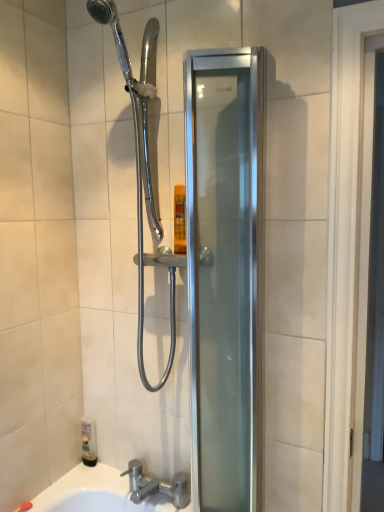
Question: Is translucent plastic bottle at lower left smaller than satin silver glass shower door at center?

Choices:
 (A) yes
 (B) no

Answer: (A)

Question: Is translucent plastic bottle at lower left bigger than satin silver glass shower door at center?

Choices:
 (A) yes
 (B) no

Answer: (B)

Question: Would you say translucent plastic bottle at lower left is outside satin silver glass shower door at center?

Choices:
 (A) no
 (B) yes

Answer: (B)

Question: Does translucent plastic bottle at lower left appear on the right side of satin silver glass shower door at center?

Choices:
 (A) yes
 (B) no

Answer: (B)

Question: From the image's perspective, is translucent plastic bottle at lower left under satin silver glass shower door at center?

Choices:
 (A) yes
 (B) no

Answer: (A)

Question: Is satin silver glass shower door at center situated inside silver metallic faucet at lower center or outside?

Choices:
 (A) inside
 (B) outside

Answer: (B)

Question: In terms of height, does satin silver glass shower door at center look taller or shorter compared to silver metallic faucet at lower center?

Choices:
 (A) short
 (B) tall

Answer: (B)

Question: Visually, is satin silver glass shower door at center positioned to the left or to the right of silver metallic faucet at lower center?

Choices:
 (A) right
 (B) left

Answer: (A)

Question: Based on their sizes in the image, would you say satin silver glass shower door at center is bigger or smaller than silver metallic faucet at lower center?

Choices:
 (A) big
 (B) small

Answer: (A)

Question: Looking at their shapes, would you say silver metallic faucet at lower center is wider or thinner than translucent plastic bottle at lower left?

Choices:
 (A) wide
 (B) thin

Answer: (A)

Question: Is silver metallic faucet at lower center situated inside translucent plastic bottle at lower left or outside?

Choices:
 (A) inside
 (B) outside

Answer: (B)

Question: Visually, is silver metallic faucet at lower center positioned to the left or to the right of translucent plastic bottle at lower left?

Choices:
 (A) left
 (B) right

Answer: (B)

Question: Is point (175, 489) closer or farther from the camera than point (84, 459)?

Choices:
 (A) farther
 (B) closer

Answer: (B)

Question: In the image, is silver metallic faucet at lower center on the left side or the right side of satin silver glass shower door at center?

Choices:
 (A) right
 (B) left

Answer: (B)

Question: Does point (170, 492) appear closer or farther from the camera than point (216, 158)?

Choices:
 (A) closer
 (B) farther

Answer: (B)